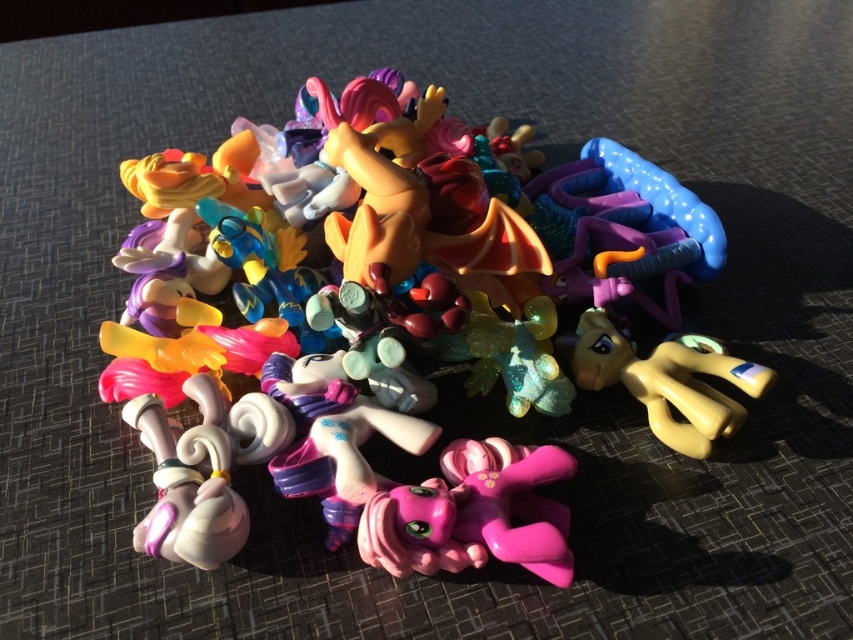
Can you confirm if glossy plastic pony at center is positioned to the left of matte yellow pony at center?

Correct, you'll find glossy plastic pony at center to the left of matte yellow pony at center.

Can you confirm if glossy plastic pony at center is smaller than matte yellow pony at center?

No, glossy plastic pony at center is not smaller than matte yellow pony at center.

Is point (495, 209) positioned before point (689, 452)?

No, (495, 209) is behind (689, 452).

The width and height of the screenshot is (853, 640). Find the location of `glossy plastic pony at center`. glossy plastic pony at center is located at coordinates pos(407,332).